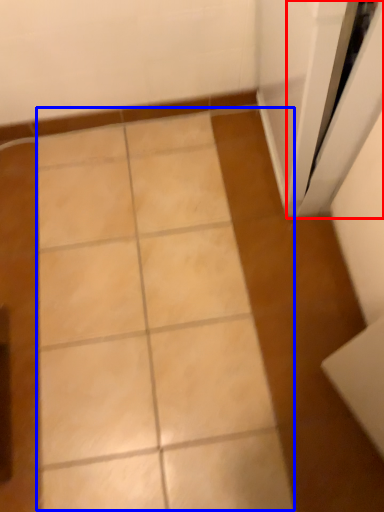
Question: Which object is further to the camera taking this photo, screen door (highlighted by a red box) or ceramic tile (highlighted by a blue box)?

Choices:
 (A) screen door
 (B) ceramic tile

Answer: (B)